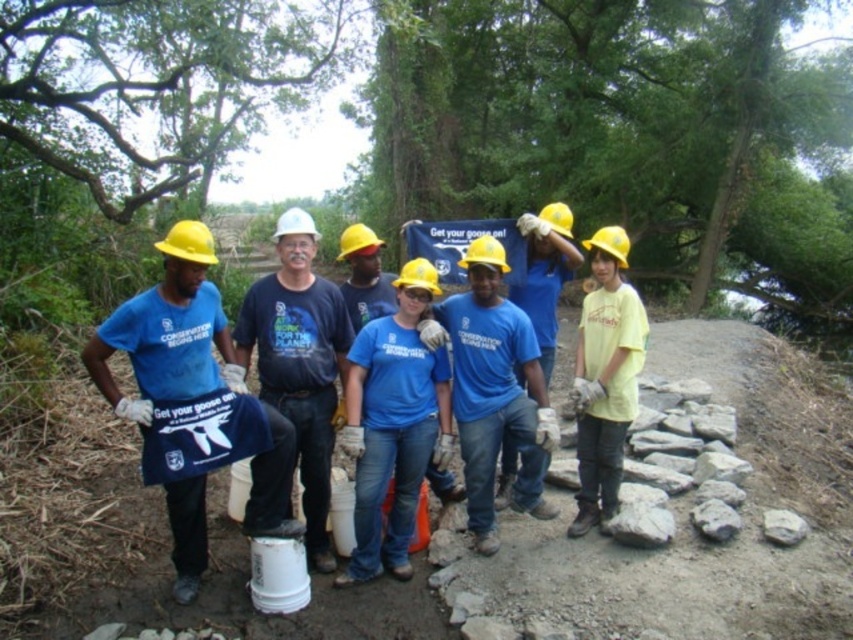
Who is shorter, matte blue shirt at center or white hard hat at center?

With less height is white hard hat at center.

Does matte blue shirt at center have a greater width compared to white hard hat at center?

Correct, the width of matte blue shirt at center exceeds that of white hard hat at center.

Describe the element at coordinates (195, 371) in the screenshot. I see `matte blue shirt at center` at that location.

At what (x,y) coordinates should I click in order to perform the action: click on matte blue shirt at center. Please return your answer as a coordinate pair (x, y). This screenshot has height=640, width=853. Looking at the image, I should click on (195, 371).

Does blue cotton shirt at center have a lesser height compared to white hard hat at center?

No, blue cotton shirt at center is not shorter than white hard hat at center.

Between blue cotton shirt at center and white hard hat at center, which one is positioned lower?

Positioned lower is blue cotton shirt at center.

Between point (519, 396) and point (248, 314), which one is positioned behind?

Point (519, 396)

You are a GUI agent. You are given a task and a screenshot of the screen. Output one action in this format:
    pyautogui.click(x=<x>, y=<y>)
    Task: Click on the blue cotton shirt at center
    This screenshot has height=640, width=853.
    Given the screenshot: What is the action you would take?
    pyautogui.click(x=496, y=392)

Is point (167, 236) more distant than point (465, 296)?

Yes, it is behind point (465, 296).

Between matte blue shirt at center and blue cotton shirt at center, which one is positioned higher?

blue cotton shirt at center is above.

Does point (90, 374) come farther from viewer compared to point (502, 298)?

No, (90, 374) is in front of (502, 298).

Find the location of a particular element. matte blue shirt at center is located at coordinates (195, 371).